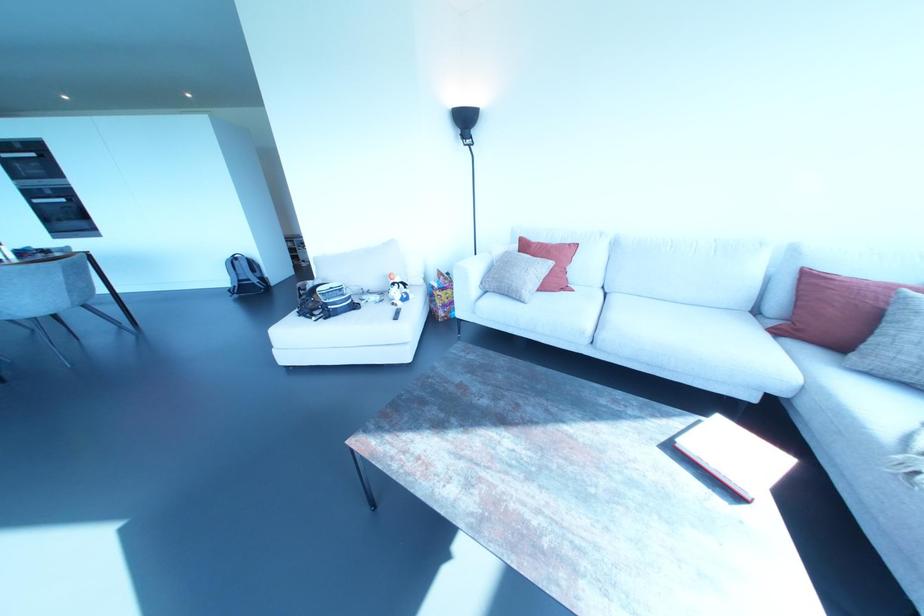
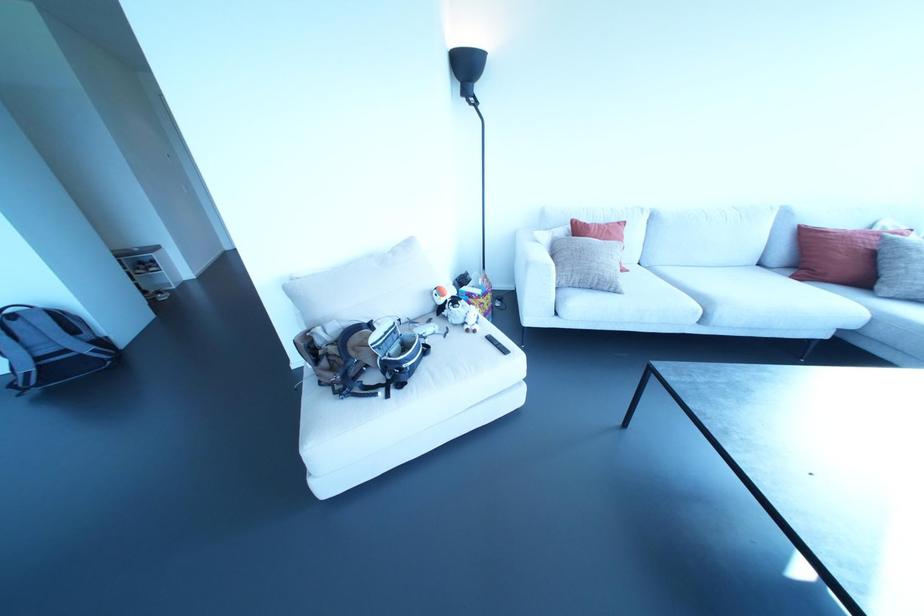
Locate, in the second image, the point that corresponds to (392,302) in the first image.

(467, 330)